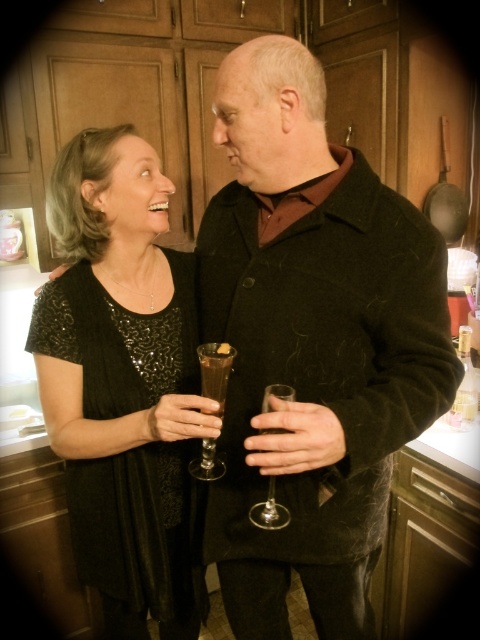
Question: From the image, what is the correct spatial relationship of brown glass at center in relation to translucent glass at center?

Choices:
 (A) left
 (B) right

Answer: (B)

Question: Considering the relative positions of brown glass at center and translucent glass at center in the image provided, where is brown glass at center located with respect to translucent glass at center?

Choices:
 (A) right
 (B) left

Answer: (A)

Question: Which point is closer to the camera?

Choices:
 (A) (94, 218)
 (B) (261, 512)
 (C) (199, 352)
 (D) (213, 369)

Answer: (D)

Question: Which of these objects is positioned farthest from the clear glass wine glass at center?

Choices:
 (A) translucent glass at center
 (B) black sequined dress at left

Answer: (B)

Question: Is the position of brown glass at center more distant than that of translucent glass at center?

Choices:
 (A) yes
 (B) no

Answer: (A)

Question: Among these objects, which one is farthest from the camera?

Choices:
 (A) clear glass wine glass at center
 (B) translucent glass at center

Answer: (B)